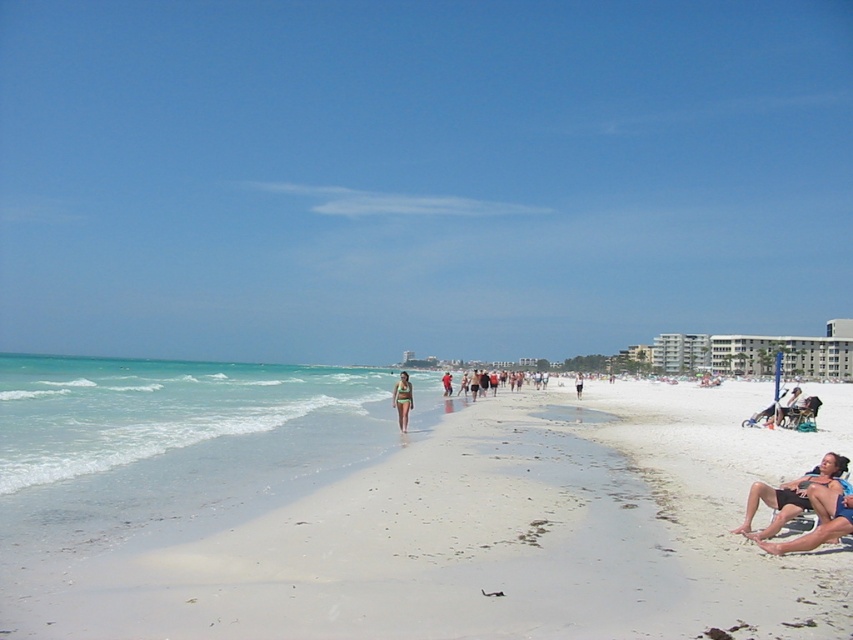
Which is behind, point (349, 554) or point (828, 486)?

Point (828, 486)

Does white sand beach at center appear on the right side of matte black bikini at lower right?

No, white sand beach at center is not to the right of matte black bikini at lower right.

The height and width of the screenshot is (640, 853). Describe the element at coordinates (398, 509) in the screenshot. I see `white sand beach at center` at that location.

Image resolution: width=853 pixels, height=640 pixels. Find the location of `white sand beach at center`. white sand beach at center is located at coordinates (398, 509).

Looking at this image, is matte black bikini at lower right closer to camera compared to green matte bikini at center?

That is True.

Find the location of `matte black bikini at lower right`. matte black bikini at lower right is located at coordinates [x=790, y=496].

Is point (833, 488) closer to camera compared to point (393, 404)?

Yes, point (833, 488) is closer to viewer.

This screenshot has height=640, width=853. Identify the location of matte black bikini at lower right. (790, 496).

Does white sand beach at center have a greater width compared to clear blue water at lower left?

In fact, white sand beach at center might be narrower than clear blue water at lower left.

Who is positioned more to the left, white sand beach at center or clear blue water at lower left?

→ Positioned to the left is clear blue water at lower left.

Who is more forward, (103, 500) or (90, 449)?

→ Point (103, 500) is in front.

Where is `white sand beach at center`? white sand beach at center is located at coordinates (398, 509).